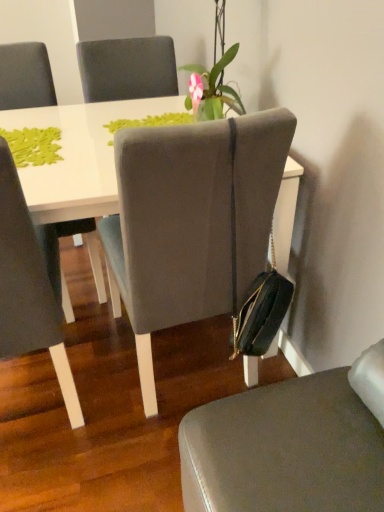
You are a GUI agent. You are given a task and a screenshot of the screen. Output one action in this format:
    pyautogui.click(x=<x>, y=<y>)
    Task: Click on the suede-like gray chair at center, which is the second chair in right-to-left order
    
    Given the screenshot: What is the action you would take?
    pyautogui.click(x=191, y=222)

This screenshot has height=512, width=384. Identify the location of green matte plant at upper center. (217, 75).

At what (x,y) coordinates should I click in order to perform the action: click on suede-like gray chair at center, which is the second chair in right-to-left order. Please return your answer as a coordinate pair (x, y). The height and width of the screenshot is (512, 384). Looking at the image, I should click on (191, 222).

Considering the relative positions of matte gray chair at center, which appears as the first chair when viewed from the right, and matte gray chair at left, positioned as the third chair in right-to-left order, in the image provided, is matte gray chair at center, which appears as the first chair when viewed from the right, to the left of matte gray chair at left, positioned as the third chair in right-to-left order, from the viewer's perspective?

Incorrect, matte gray chair at center, which appears as the first chair when viewed from the right, is not on the left side of matte gray chair at left, positioned as the third chair in right-to-left order.

From a real-world perspective, who is located higher, matte gray chair at center, which appears as the first chair when viewed from the right, or matte gray chair at left, the 1th chair viewed from the left?

In real-world perspective, matte gray chair at left, the 1th chair viewed from the left, is above.

Is matte gray chair at center, which appears as the first chair when viewed from the right, not within matte gray chair at left, positioned as the third chair in right-to-left order?

matte gray chair at center, which appears as the first chair when viewed from the right, is positioned outside matte gray chair at left, positioned as the third chair in right-to-left order.

Considering the sizes of matte gray chair at center, which appears as the first chair when viewed from the right, and matte gray chair at left, positioned as the third chair in right-to-left order, in the image, is matte gray chair at center, which appears as the first chair when viewed from the right, taller or shorter than matte gray chair at left, positioned as the third chair in right-to-left order,?

Clearly, matte gray chair at center, which appears as the first chair when viewed from the right, is shorter compared to matte gray chair at left, positioned as the third chair in right-to-left order.

Is suede-like gray chair at center, placed as the 2th chair when sorted from left to right, facing away from matte gray chair at left, positioned as the third chair in right-to-left order?

That's not correct — suede-like gray chair at center, placed as the 2th chair when sorted from left to right, is not looking away from matte gray chair at left, positioned as the third chair in right-to-left order.

Locate an element on the screen. The image size is (384, 512). the 1st chair in front of the suede-like gray chair at center, placed as the 2th chair when sorted from left to right is located at coordinates (28, 288).

How much distance is there between suede-like gray chair at center, placed as the 2th chair when sorted from left to right, and matte gray chair at left, the 1th chair viewed from the left?

They are 13.68 inches apart.

Based on the photo, from the image's perspective, is suede-like gray chair at center, which is the second chair in right-to-left order, on matte gray chair at left, the 1th chair viewed from the left?

Indeed, from the image's perspective, suede-like gray chair at center, which is the second chair in right-to-left order, is shown above matte gray chair at left, the 1th chair viewed from the left.

Does green matte plant at upper center turn towards matte gray chair at center, which appears as the first chair when viewed from the right?

No, green matte plant at upper center is not facing towards matte gray chair at center, which appears as the first chair when viewed from the right.

Starting from the green matte plant at upper center, which chair is the 3rd one in front? Please provide its 2D coordinates.

[(290, 445)]

Would you say green matte plant at upper center is to the left or to the right of matte gray chair at center, which appears as the first chair when viewed from the right, in the picture?

In the image, green matte plant at upper center appears on the left side of matte gray chair at center, which appears as the first chair when viewed from the right.

Looking at this image, from a real-world perspective, between green matte plant at upper center and matte gray chair at center, arranged as the 3th chair when viewed from the left, who is vertically lower?

In real-world perspective, matte gray chair at center, arranged as the 3th chair when viewed from the left, is lower.

Locate an element on the screen. The width and height of the screenshot is (384, 512). the 3rd chair located beneath the green matte plant at upper center (from a real-world perspective) is located at coordinates (290, 445).

From a real-world perspective, which object stands above the other?

In real-world perspective, green matte plant at upper center is above.

Considering the relative sizes of matte gray chair at center, arranged as the 3th chair when viewed from the left, and green matte plant at upper center in the image provided, is matte gray chair at center, arranged as the 3th chair when viewed from the left, shorter than green matte plant at upper center?

No.

Considering the relative sizes of suede-like gray chair at center, placed as the 2th chair when sorted from left to right, and green matte plant at upper center in the image provided, is suede-like gray chair at center, placed as the 2th chair when sorted from left to right, thinner than green matte plant at upper center?

No, suede-like gray chair at center, placed as the 2th chair when sorted from left to right, is not thinner than green matte plant at upper center.

Is suede-like gray chair at center, placed as the 2th chair when sorted from left to right, located outside green matte plant at upper center?

That's correct, suede-like gray chair at center, placed as the 2th chair when sorted from left to right, is outside of green matte plant at upper center.

Could you measure the distance between suede-like gray chair at center, which is the second chair in right-to-left order, and green matte plant at upper center?

A distance of 47.47 centimeters exists between suede-like gray chair at center, which is the second chair in right-to-left order, and green matte plant at upper center.

In the scene shown: Between suede-like gray chair at center, which is the second chair in right-to-left order, and green matte plant at upper center, which one has smaller size?

With smaller size is green matte plant at upper center.

How different are the orientations of green matte plant at upper center and matte gray chair at left, the 1th chair viewed from the left, in degrees?

90 degrees.

In terms of width, does green matte plant at upper center look wider or thinner when compared to matte gray chair at left, the 1th chair viewed from the left?

Clearly, green matte plant at upper center has less width compared to matte gray chair at left, the 1th chair viewed from the left.

In order to click on the 2nd chair in front of the green matte plant at upper center in this screenshot , I will do `click(28, 288)`.

Is green matte plant at upper center aimed at matte gray chair at left, positioned as the third chair in right-to-left order?

Yes, green matte plant at upper center is facing matte gray chair at left, positioned as the third chair in right-to-left order.

From the image's perspective, between matte gray chair at center, arranged as the 3th chair when viewed from the left, and suede-like gray chair at center, which is the second chair in right-to-left order, which one is located above?

From the image's view, suede-like gray chair at center, which is the second chair in right-to-left order, is above.

Is point (361, 450) less distant than point (164, 270)?

Yes, point (361, 450) is closer to viewer.

From the picture: Measure the distance between matte gray chair at center, which appears as the first chair when viewed from the right, and suede-like gray chair at center, which is the second chair in right-to-left order.

A distance of 17.42 inches exists between matte gray chair at center, which appears as the first chair when viewed from the right, and suede-like gray chair at center, which is the second chair in right-to-left order.

At what (x,y) coordinates should I click in order to perform the action: click on chair below the matte gray chair at left, the 1th chair viewed from the left (from a real-world perspective). Please return your answer as a coordinate pair (x, y). The width and height of the screenshot is (384, 512). Looking at the image, I should click on (290, 445).

Image resolution: width=384 pixels, height=512 pixels. Identify the location of the 1st chair positioned below the suede-like gray chair at center, which is the second chair in right-to-left order (from the image's perspective). (28, 288).

Which object lies further to the anchor point matte gray chair at left, the 1th chair viewed from the left, matte gray chair at center, arranged as the 3th chair when viewed from the left, or green matte plant at upper center?

green matte plant at upper center is further to matte gray chair at left, the 1th chair viewed from the left.

Looking at the image, which one is located further to suede-like gray chair at center, which is the second chair in right-to-left order, matte gray chair at left, the 1th chair viewed from the left, or matte gray chair at center, which appears as the first chair when viewed from the right?

matte gray chair at center, which appears as the first chair when viewed from the right, is further to suede-like gray chair at center, which is the second chair in right-to-left order.

Based on their spatial positions, is matte gray chair at left, positioned as the third chair in right-to-left order, or green matte plant at upper center further from suede-like gray chair at center, which is the second chair in right-to-left order?

green matte plant at upper center lies further to suede-like gray chair at center, which is the second chair in right-to-left order, than the other object.

Estimate the real-world distances between objects in this image. Which object is further from suede-like gray chair at center, placed as the 2th chair when sorted from left to right, green matte plant at upper center or matte gray chair at left, the 1th chair viewed from the left?

Based on the image, green matte plant at upper center appears to be further to suede-like gray chair at center, placed as the 2th chair when sorted from left to right.

When comparing their distances from matte gray chair at center, which appears as the first chair when viewed from the right, does green matte plant at upper center or suede-like gray chair at center, placed as the 2th chair when sorted from left to right, seem further?

Based on the image, green matte plant at upper center appears to be further to matte gray chair at center, which appears as the first chair when viewed from the right.

Based on their spatial positions, is suede-like gray chair at center, placed as the 2th chair when sorted from left to right, or matte gray chair at left, positioned as the third chair in right-to-left order, further from green matte plant at upper center?

Among the two, matte gray chair at left, positioned as the third chair in right-to-left order, is located further to green matte plant at upper center.

Estimate the real-world distances between objects in this image. Which object is further from green matte plant at upper center, matte gray chair at left, positioned as the third chair in right-to-left order, or suede-like gray chair at center, placed as the 2th chair when sorted from left to right?

matte gray chair at left, positioned as the third chair in right-to-left order.

Looking at the image, which one is located closer to matte gray chair at left, the 1th chair viewed from the left, green matte plant at upper center or matte gray chair at center, which appears as the first chair when viewed from the right?

matte gray chair at center, which appears as the first chair when viewed from the right.

Identify the location of chair situated between matte gray chair at left, positioned as the third chair in right-to-left order, and matte gray chair at center, arranged as the 3th chair when viewed from the left, from left to right. This screenshot has width=384, height=512. (191, 222).

Where is `chair that lies between green matte plant at upper center and matte gray chair at left, the 1th chair viewed from the left, from top to bottom`? chair that lies between green matte plant at upper center and matte gray chair at left, the 1th chair viewed from the left, from top to bottom is located at coordinates [191, 222].